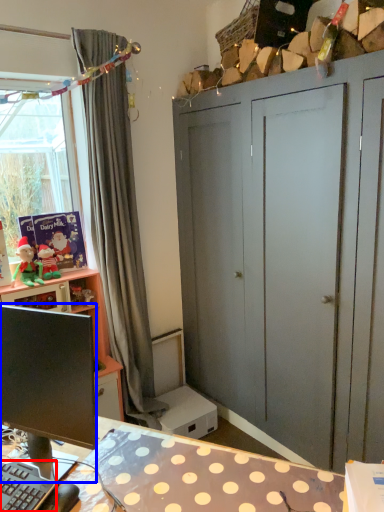
Question: Which point is closer to the camera, computer keyboard (highlighted by a red box) or computer monitor (highlighted by a blue box)?

Choices:
 (A) computer keyboard
 (B) computer monitor

Answer: (B)